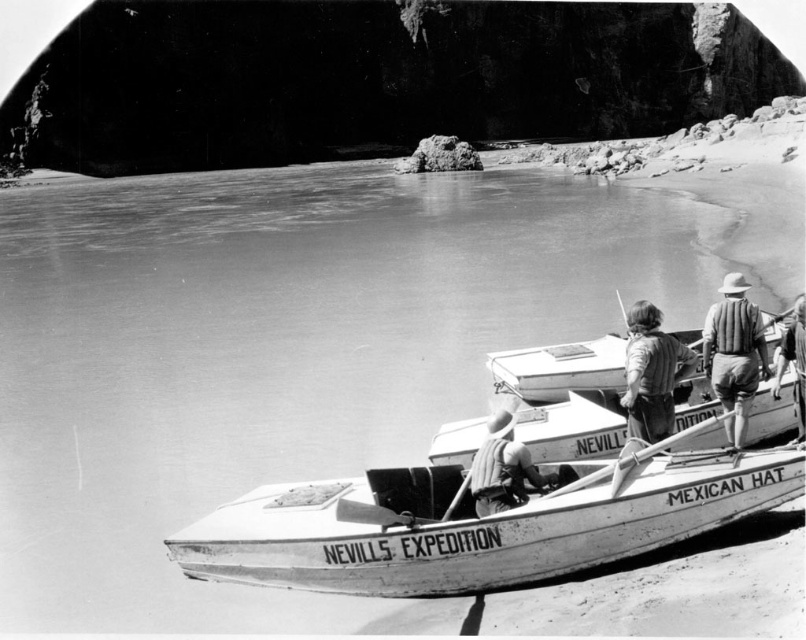
Question: Is white matte boat at center to the right of light brown fabric jacket at center from the viewer's perspective?

Choices:
 (A) yes
 (B) no

Answer: (A)

Question: Among these objects, which one is farthest from the camera?

Choices:
 (A) white wood boat at center
 (B) white matte boat at center
 (C) light brown fabric jacket at center
 (D) striped fabric hat at rear

Answer: (B)

Question: Can you confirm if white wood boat at center is thinner than light brown fabric jacket at center?

Choices:
 (A) no
 (B) yes

Answer: (A)

Question: Which point is closer to the camera?

Choices:
 (A) (634, 416)
 (B) (331, 621)
 (C) (750, 342)
 (D) (555, 346)

Answer: (B)

Question: Can you confirm if white matte boat at center is thinner than light brown wooden oar at right?

Choices:
 (A) yes
 (B) no

Answer: (B)

Question: Estimate the real-world distances between objects in this image. Which object is farther from the smooth water at center?

Choices:
 (A) light brown wooden oar at right
 (B) white wood boat at center
 (C) smooth brown shirt at center
 (D) striped fabric hat at rear

Answer: (C)